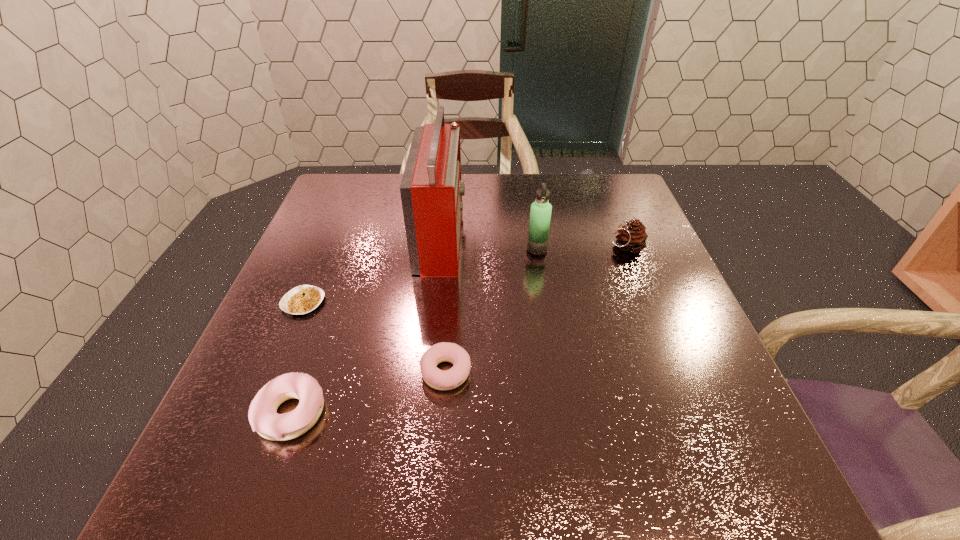
Where is `the fifth shortest object`? This screenshot has height=540, width=960. the fifth shortest object is located at coordinates (540, 215).

You are a GUI agent. You are given a task and a screenshot of the screen. Output one action in this format:
    pyautogui.click(x=<x>, y=<y>)
    Task: Click on the free location located 0.200m on the right of the fourth tallest object
    
    Given the screenshot: What is the action you would take?
    pyautogui.click(x=440, y=413)

The height and width of the screenshot is (540, 960). Find the location of `free space located on the left of the shorter doughnut`. free space located on the left of the shorter doughnut is located at coordinates tap(341, 372).

Where is `free spot located 0.290m with a leaf charm attached to the third tallest object`? This screenshot has width=960, height=540. free spot located 0.290m with a leaf charm attached to the third tallest object is located at coordinates (492, 247).

The image size is (960, 540). What are the coordinates of `free region located with a leaf charm attached to the third tallest object` in the screenshot? It's located at (500, 247).

The width and height of the screenshot is (960, 540). What are the coordinates of `vacant region located with a leaf charm attached to the third tallest object` in the screenshot? It's located at (579, 247).

In order to click on vacant space located on the back of the legume in this screenshot , I will do click(x=341, y=212).

In order to click on free space located 0.400m on the front-facing side of the radio receiver in this screenshot , I will do `click(617, 236)`.

This screenshot has width=960, height=540. What are the coordinates of `free point located on the front of the second object from right to left` in the screenshot? It's located at (547, 318).

Where is `object present at the far edge`? object present at the far edge is located at coordinates (431, 189).